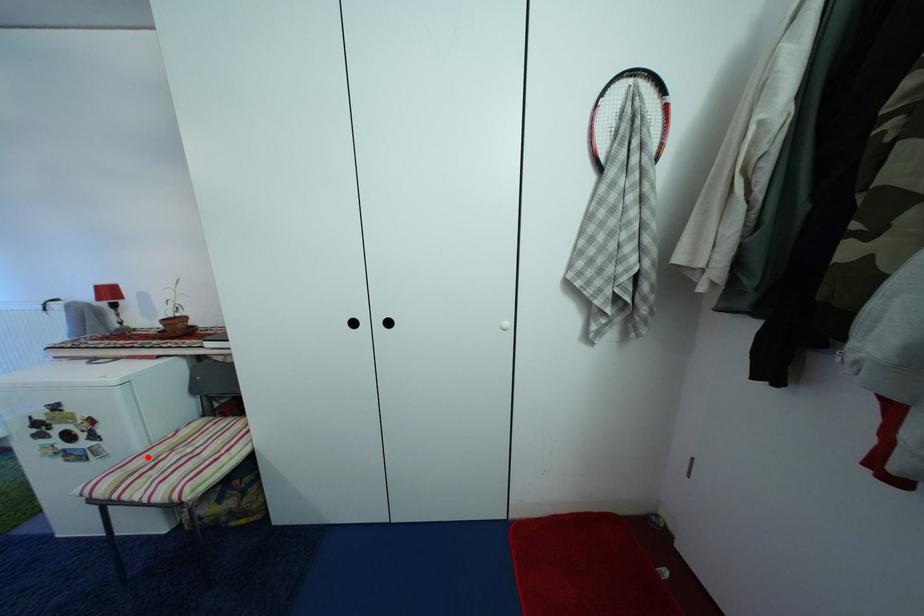
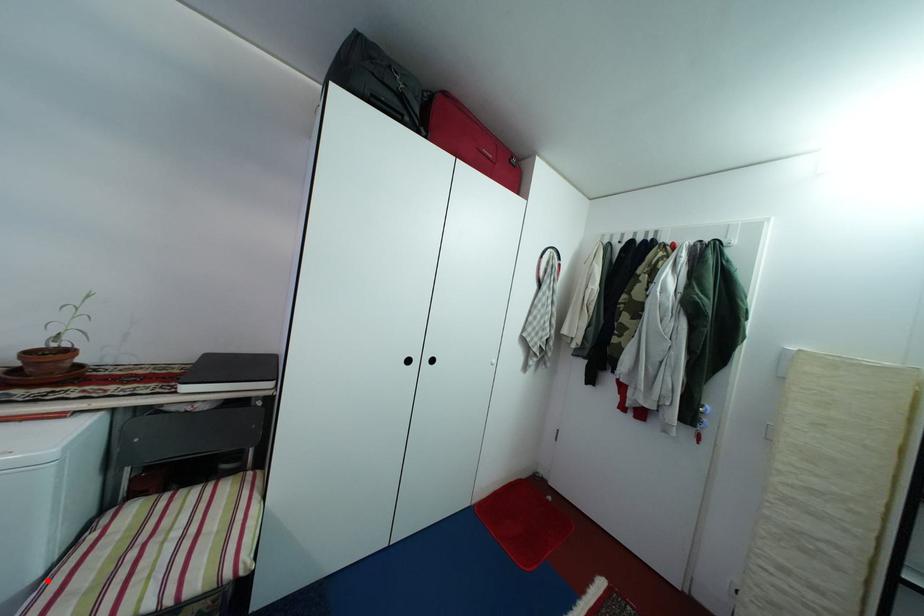
I am providing you with two images of the same scene from different viewpoints. A red point is marked on the first image and another point is marked on the second image. Is the red point in image1 aligned with the point shown in image2?

Yes